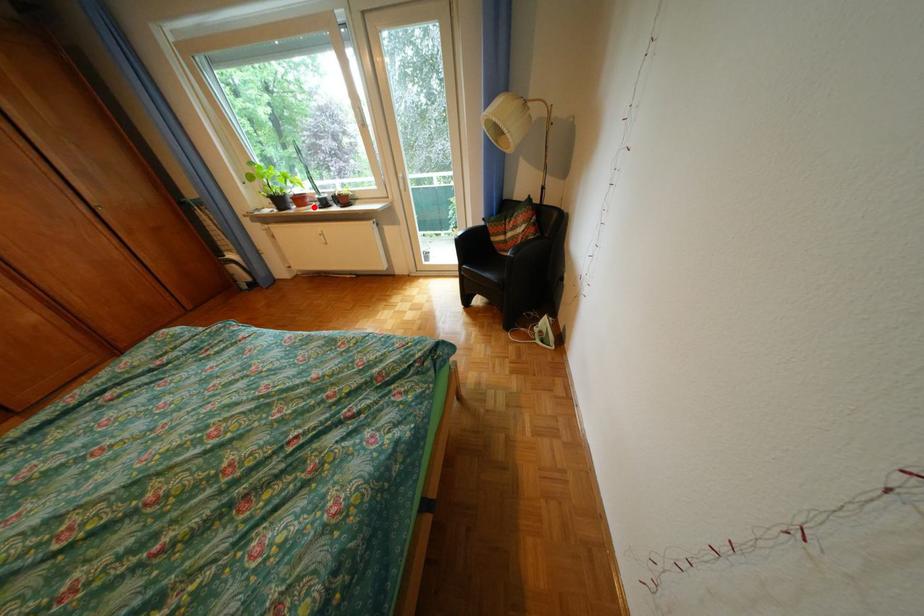
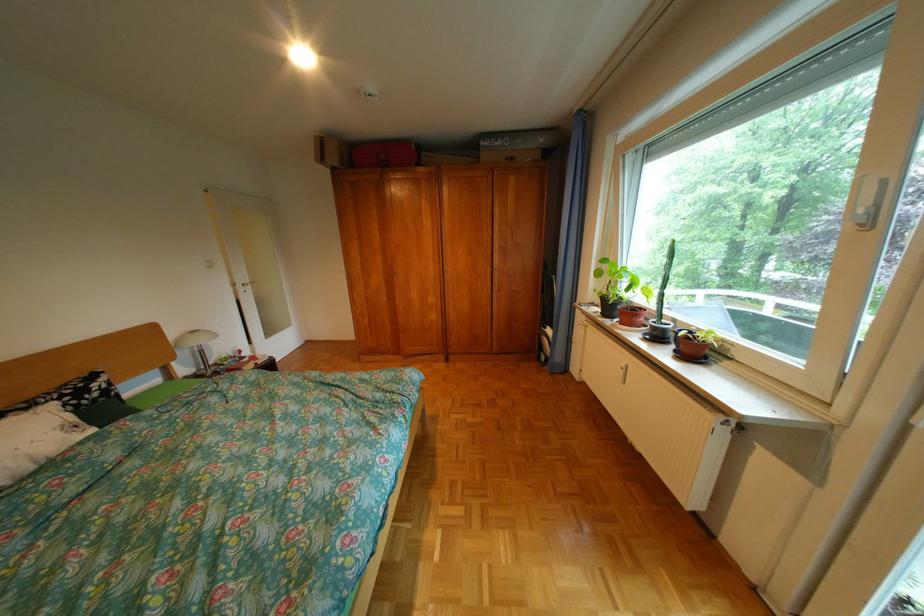
Find the pixel in the second image that matches the highlighted location in the first image.

(636, 323)